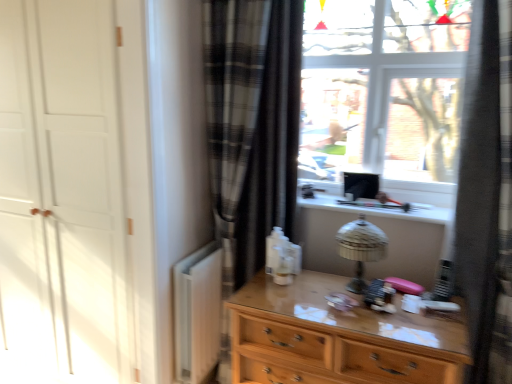
Question: Could you tell me if metallic silver table lamp at center is turned towards black plaid curtain at right?

Choices:
 (A) yes
 (B) no

Answer: (B)

Question: Is metallic silver table lamp at center smaller than black plaid curtain at right?

Choices:
 (A) no
 (B) yes

Answer: (B)

Question: Is metallic silver table lamp at center closer to camera compared to black plaid curtain at right?

Choices:
 (A) yes
 (B) no

Answer: (B)

Question: Can you confirm if metallic silver table lamp at center is wider than black plaid curtain at right?

Choices:
 (A) yes
 (B) no

Answer: (B)

Question: Does metallic silver table lamp at center appear on the left side of black plaid curtain at right?

Choices:
 (A) yes
 (B) no

Answer: (A)

Question: From a real-world perspective, is black plaid curtain at right physically located above or below wooden chest of drawers at center?

Choices:
 (A) below
 (B) above

Answer: (B)

Question: From the image's perspective, is black plaid curtain at right above or below wooden chest of drawers at center?

Choices:
 (A) above
 (B) below

Answer: (A)

Question: Is black plaid curtain at right situated inside wooden chest of drawers at center or outside?

Choices:
 (A) inside
 (B) outside

Answer: (B)

Question: Does point (483, 230) appear closer or farther from the camera than point (429, 362)?

Choices:
 (A) closer
 (B) farther

Answer: (B)

Question: Is white matte radiator at lower left inside or outside of wooden chest of drawers at center?

Choices:
 (A) inside
 (B) outside

Answer: (B)

Question: Considering the positions of point (200, 274) and point (288, 364), is point (200, 274) closer or farther from the camera than point (288, 364)?

Choices:
 (A) farther
 (B) closer

Answer: (A)

Question: Is white matte radiator at lower left taller or shorter than wooden chest of drawers at center?

Choices:
 (A) tall
 (B) short

Answer: (B)

Question: From the image's perspective, relative to wooden chest of drawers at center, is white matte radiator at lower left above or below?

Choices:
 (A) above
 (B) below

Answer: (A)

Question: Does point (266, 67) appear closer or farther from the camera than point (493, 230)?

Choices:
 (A) closer
 (B) farther

Answer: (B)

Question: Is plaid fabric curtain at center wider or thinner than black plaid curtain at right?

Choices:
 (A) wide
 (B) thin

Answer: (B)